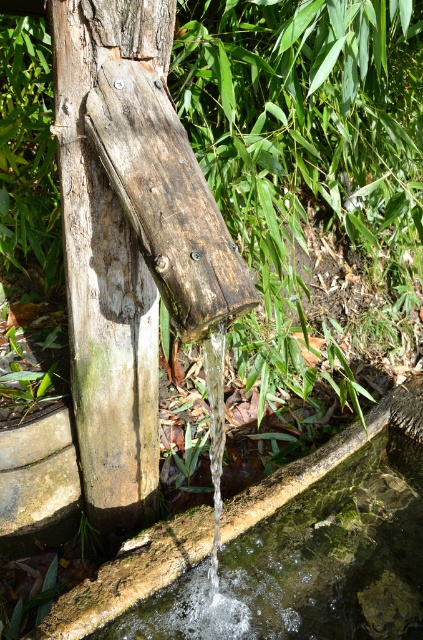
Question: Is weathered wood at center closer to camera compared to clear water at lower center?

Choices:
 (A) yes
 (B) no

Answer: (A)

Question: Among these points, which one is farthest from the camera?

Choices:
 (A) (164, 56)
 (B) (208, 605)

Answer: (B)

Question: Is weathered wood at center thinner than clear water at lower center?

Choices:
 (A) yes
 (B) no

Answer: (A)

Question: Among these points, which one is farthest from the camera?

Choices:
 (A) (63, 220)
 (B) (288, 557)

Answer: (B)

Question: Is weathered wood at center closer to camera compared to clear water at lower center?

Choices:
 (A) no
 (B) yes

Answer: (B)